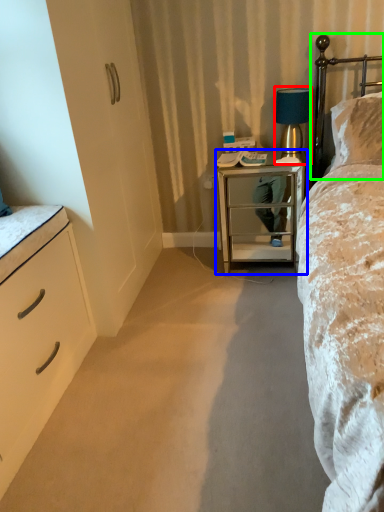
Question: Considering the real-world distances, which object is farthest from table lamp (highlighted by a red box)? nightstand (highlighted by a blue box) or headboard (highlighted by a green box)?

Choices:
 (A) nightstand
 (B) headboard

Answer: (A)